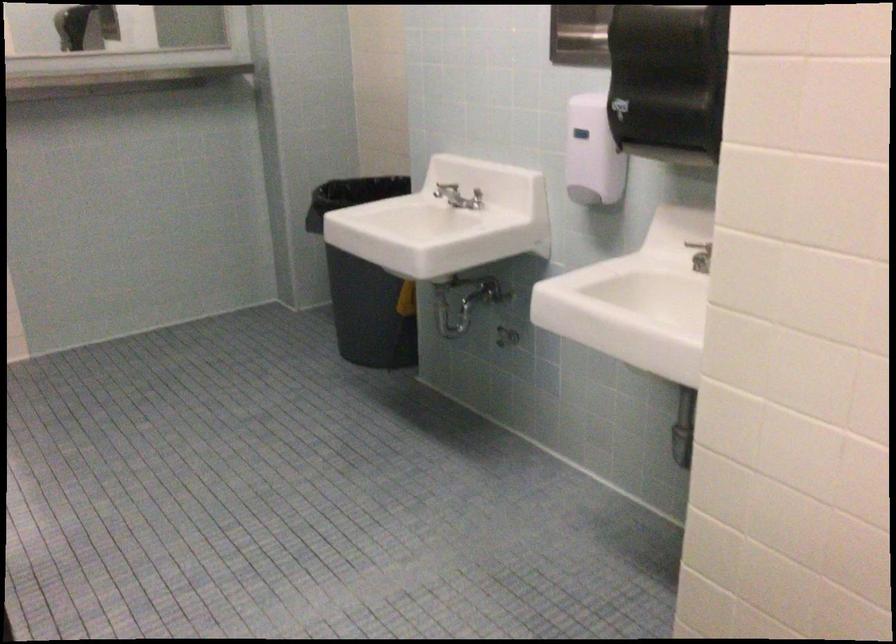
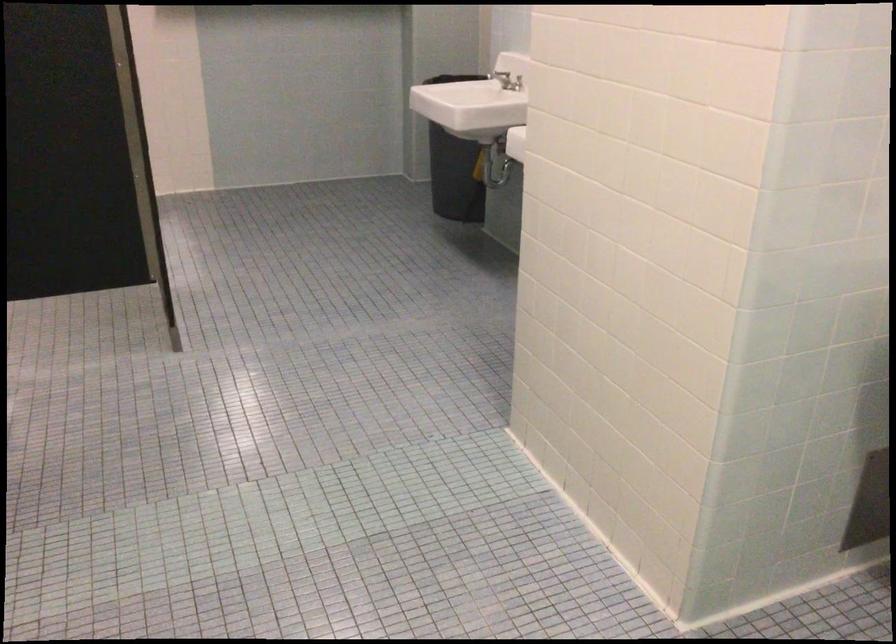
Find the pixel in the second image that matches the point at 367,308 in the first image.

(453, 167)